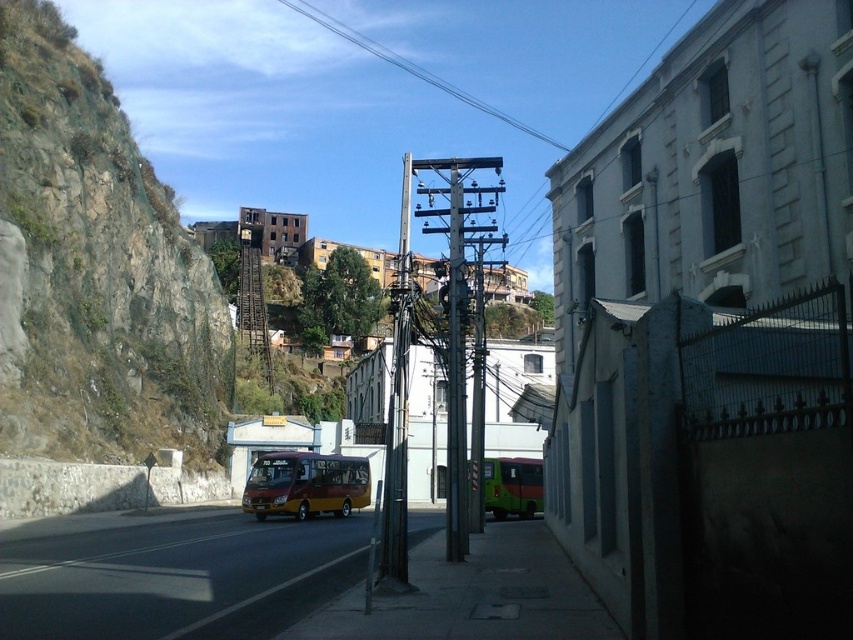
Question: Does greenish-brown rock at left have a lesser width compared to metallic gray telegraph pole at center?

Choices:
 (A) no
 (B) yes

Answer: (A)

Question: Is the position of greenish-brown rock at left less distant than that of clear wire at upper center?

Choices:
 (A) yes
 (B) no

Answer: (A)

Question: Estimate the real-world distances between objects in this image. Which object is farther from the metallic gray telegraph pole at center?

Choices:
 (A) maroon matte bus at center
 (B) green matte school bus at lower right
 (C) concrete sidewalk at center
 (D) greenish-brown rock at left

Answer: (D)

Question: Which object is positioned farthest from the concrete sidewalk at center?

Choices:
 (A) greenish-brown rock at left
 (B) clear wire at upper center
 (C) maroon matte bus at center

Answer: (B)

Question: Does greenish-brown rock at left have a larger size compared to metallic gray telegraph pole at center?

Choices:
 (A) no
 (B) yes

Answer: (A)

Question: Which object is farther from the camera taking this photo?

Choices:
 (A) clear wire at upper center
 (B) concrete sidewalk at center

Answer: (A)